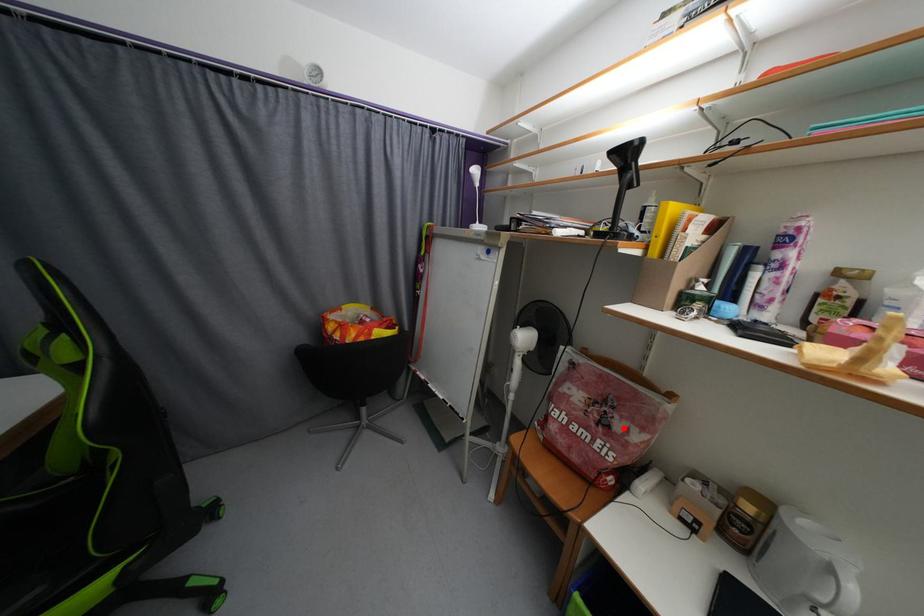
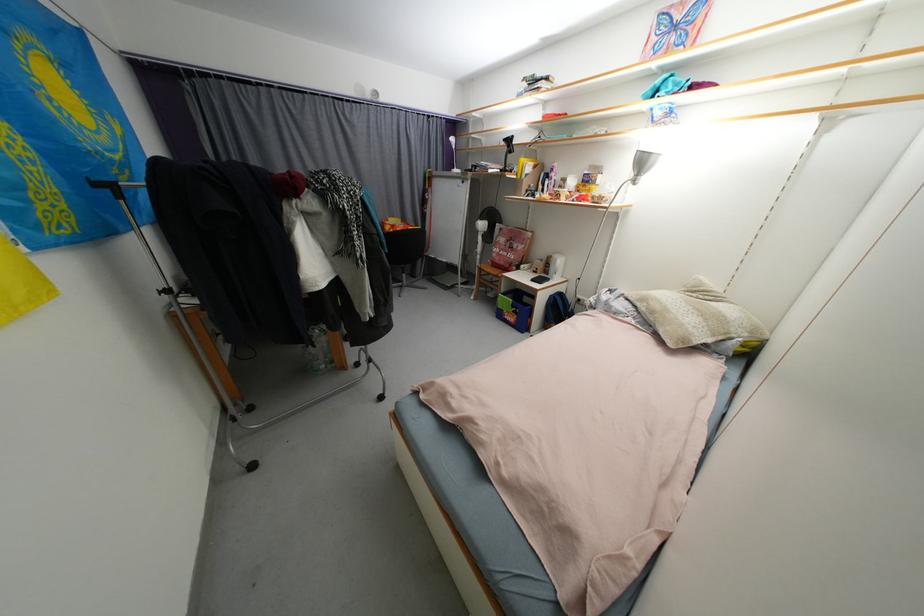
Question: I am providing you with two images of the same scene from different viewpoints. A red point is marked on the first image. Can you still see the location of the red point in image 2?

Choices:
 (A) Yes
 (B) No

Answer: (A)